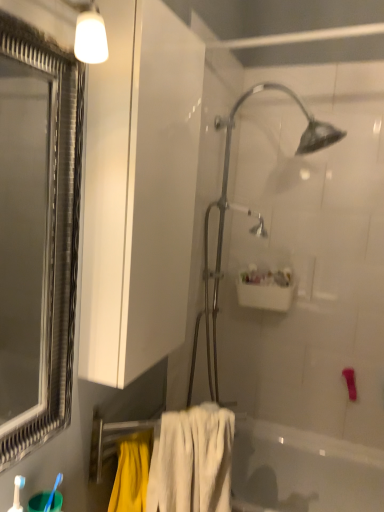
Question: Does white soft towel at lower center have a greater width compared to blue plastic toothbrush at lower left?

Choices:
 (A) no
 (B) yes

Answer: (B)

Question: Does white soft towel at lower center contain blue plastic toothbrush at lower left?

Choices:
 (A) yes
 (B) no

Answer: (B)

Question: Considering the relative sizes of white soft towel at lower center and blue plastic toothbrush at lower left in the image provided, is white soft towel at lower center bigger than blue plastic toothbrush at lower left?

Choices:
 (A) no
 (B) yes

Answer: (B)

Question: Considering the relative positions of white soft towel at lower center and blue plastic toothbrush at lower left in the image provided, is white soft towel at lower center to the right of blue plastic toothbrush at lower left from the viewer's perspective?

Choices:
 (A) yes
 (B) no

Answer: (A)

Question: Does white soft towel at lower center have a greater height compared to blue plastic toothbrush at lower left?

Choices:
 (A) yes
 (B) no

Answer: (A)

Question: From their relative heights in the image, would you say blue plastic toothbrush at lower left is taller or shorter than white glossy sink at upper center?

Choices:
 (A) tall
 (B) short

Answer: (B)

Question: From a real-world perspective, relative to white glossy sink at upper center, is blue plastic toothbrush at lower left vertically above or below?

Choices:
 (A) below
 (B) above

Answer: (A)

Question: Looking at their shapes, would you say blue plastic toothbrush at lower left is wider or thinner than white glossy sink at upper center?

Choices:
 (A) thin
 (B) wide

Answer: (A)

Question: Considering the positions of blue plastic toothbrush at lower left and white glossy sink at upper center in the image, is blue plastic toothbrush at lower left bigger or smaller than white glossy sink at upper center?

Choices:
 (A) small
 (B) big

Answer: (A)

Question: From the image's perspective, relative to metallic silver shower head at center, is blue plastic toothbrush at lower left above or below?

Choices:
 (A) above
 (B) below

Answer: (B)

Question: Does point (51, 498) appear closer or farther from the camera than point (225, 167)?

Choices:
 (A) closer
 (B) farther

Answer: (A)

Question: Is blue plastic toothbrush at lower left to the left or to the right of metallic silver shower head at center in the image?

Choices:
 (A) right
 (B) left

Answer: (B)

Question: From their relative heights in the image, would you say blue plastic toothbrush at lower left is taller or shorter than metallic silver shower head at center?

Choices:
 (A) tall
 (B) short

Answer: (B)

Question: Is white soft towel at lower center bigger or smaller than white glossy sink at upper center?

Choices:
 (A) small
 (B) big

Answer: (B)

Question: From the image's perspective, is white soft towel at lower center located above or below white glossy sink at upper center?

Choices:
 (A) above
 (B) below

Answer: (B)